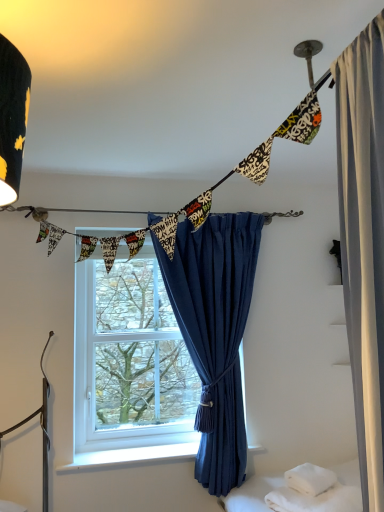
Question: Can white soft towel at lower right be found inside clear glass window at center?

Choices:
 (A) yes
 (B) no

Answer: (B)

Question: Does clear glass window at center come behind white soft towel at lower right?

Choices:
 (A) no
 (B) yes

Answer: (B)

Question: From a real-world perspective, does clear glass window at center sit lower than white soft towel at lower right?

Choices:
 (A) yes
 (B) no

Answer: (B)

Question: Does clear glass window at center have a greater width compared to white soft towel at lower right?

Choices:
 (A) yes
 (B) no

Answer: (B)

Question: Considering the relative sizes of clear glass window at center and white soft towel at lower right in the image provided, is clear glass window at center thinner than white soft towel at lower right?

Choices:
 (A) no
 (B) yes

Answer: (B)

Question: Is clear glass window at center to the left of white soft towel at lower right from the viewer's perspective?

Choices:
 (A) no
 (B) yes

Answer: (B)

Question: Does blue velvet curtain at center have a smaller size compared to white soft towel at lower right?

Choices:
 (A) yes
 (B) no

Answer: (B)

Question: From a real-world perspective, is blue velvet curtain at center physically below white soft towel at lower right?

Choices:
 (A) no
 (B) yes

Answer: (A)

Question: From the image's perspective, is blue velvet curtain at center located above white soft towel at lower right?

Choices:
 (A) yes
 (B) no

Answer: (A)

Question: Is the depth of blue velvet curtain at center greater than that of white soft towel at lower right?

Choices:
 (A) no
 (B) yes

Answer: (B)

Question: Is blue velvet curtain at center taller than white soft towel at lower right?

Choices:
 (A) no
 (B) yes

Answer: (B)

Question: From a real-world perspective, is blue velvet curtain at center located higher than white soft towel at lower right?

Choices:
 (A) no
 (B) yes

Answer: (B)

Question: Can you confirm if printed fabric bunting at upper center is thinner than white soft pillow at lower right?

Choices:
 (A) yes
 (B) no

Answer: (A)